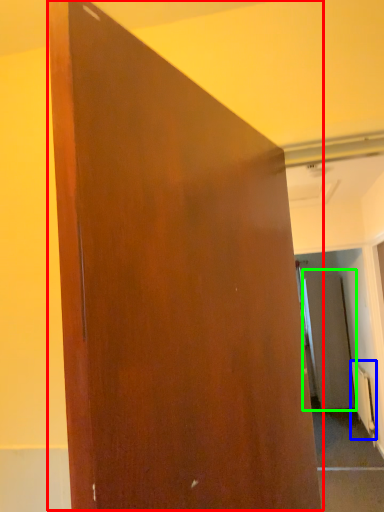
Question: Based on their relative distances, which object is nearer to door (highlighted by a red box)? Choose from radiator (highlighted by a blue box) and screen door (highlighted by a green box).

Choices:
 (A) radiator
 (B) screen door

Answer: (A)